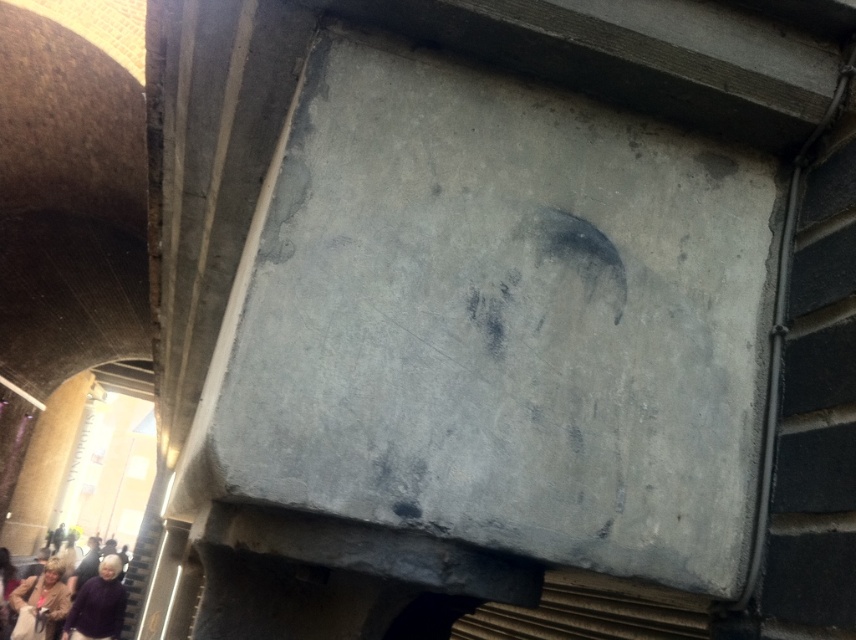
Question: Considering the relative positions of smooth gray shutter at right and light brown leather jacket at lower left in the image provided, where is smooth gray shutter at right located with respect to light brown leather jacket at lower left?

Choices:
 (A) below
 (B) above

Answer: (B)

Question: Which is farther from the light brown leather jacket at lower left?

Choices:
 (A) smooth gray shutter at right
 (B) purple sweater at lower left

Answer: (A)

Question: Among these points, which one is nearest to the camera?

Choices:
 (A) (21, 616)
 (B) (97, 634)
 (C) (837, 499)

Answer: (C)

Question: Is smooth gray shutter at right positioned before purple sweater at lower left?

Choices:
 (A) yes
 (B) no

Answer: (A)

Question: Is smooth gray shutter at right to the right of light brown leather jacket at lower left from the viewer's perspective?

Choices:
 (A) no
 (B) yes

Answer: (B)

Question: Which point is farther to the camera?

Choices:
 (A) light brown leather jacket at lower left
 (B) purple sweater at lower left

Answer: (A)